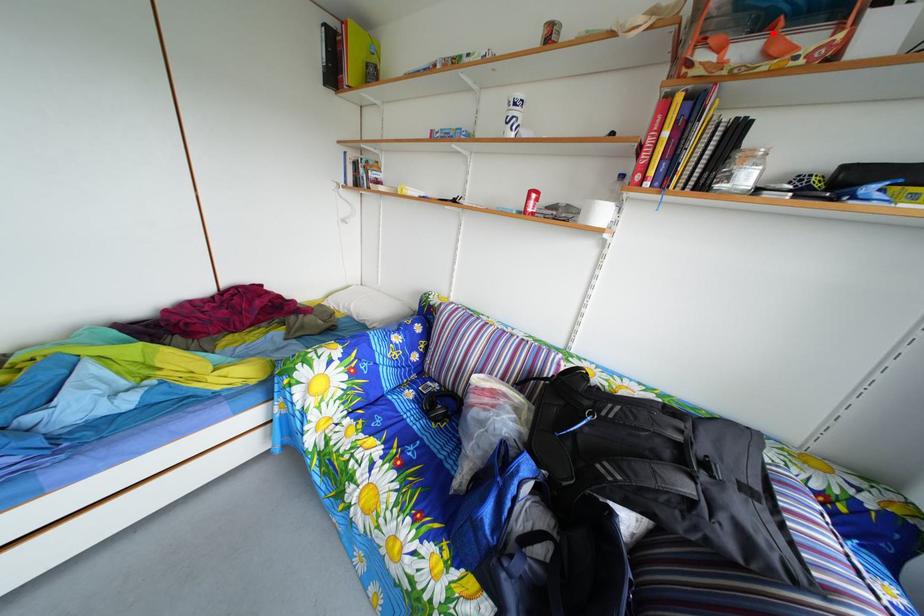
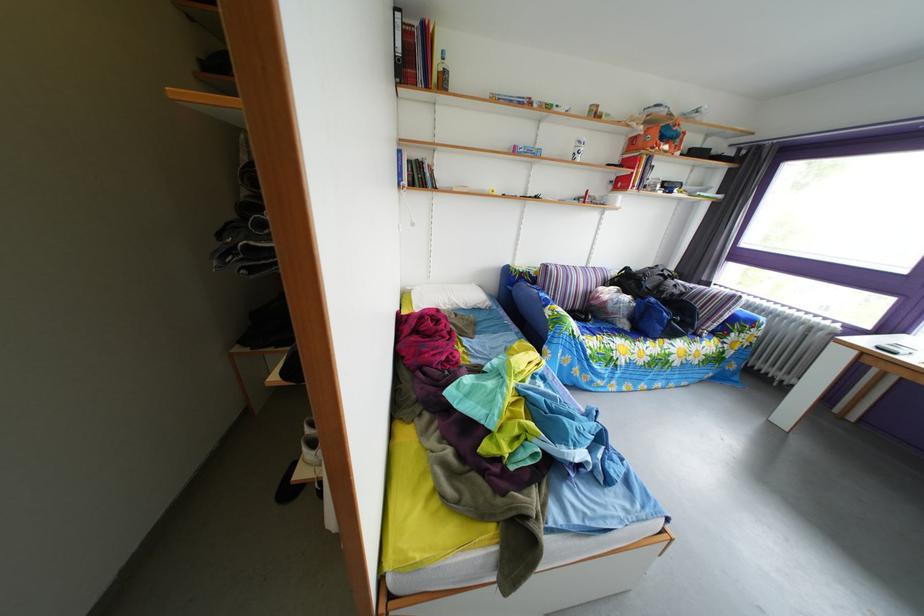
Question: I am providing you with two images of the same scene from different viewpoints. In image1, a red point is highlighted. Considering the same 3D point in image2, which of the following is correct?

Choices:
 (A) It is closer
 (B) It is farther

Answer: (A)